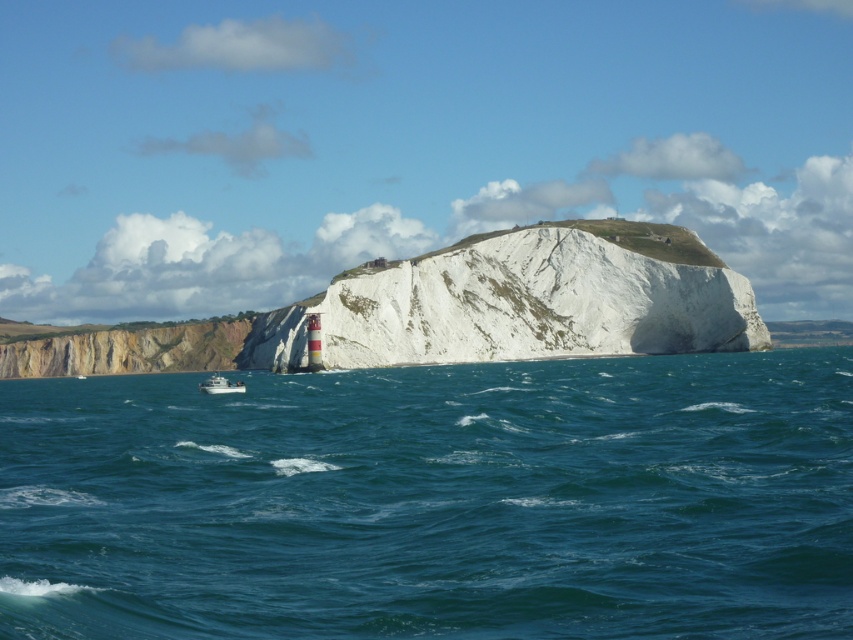
Question: Is blue water at center behind white plastic boat at lower left?

Choices:
 (A) no
 (B) yes

Answer: (A)

Question: Can you confirm if blue water at center is bigger than yellowish rock cliff at lower left?

Choices:
 (A) no
 (B) yes

Answer: (B)

Question: Which object is the farthest from the white plastic boat at lower left?

Choices:
 (A) white rocky cliff at center
 (B) yellowish rock cliff at lower left
 (C) blue water at center

Answer: (C)

Question: Among these points, which one is nearest to the camera?

Choices:
 (A) (125, 344)
 (B) (206, 385)

Answer: (B)

Question: Considering the relative positions of yellowish rock cliff at lower left and white plastic boat at lower left in the image provided, where is yellowish rock cliff at lower left located with respect to white plastic boat at lower left?

Choices:
 (A) right
 (B) left

Answer: (B)

Question: Among these objects, which one is farthest from the camera?

Choices:
 (A) white plastic boat at lower left
 (B) blue water at center
 (C) white rocky cliff at center

Answer: (C)